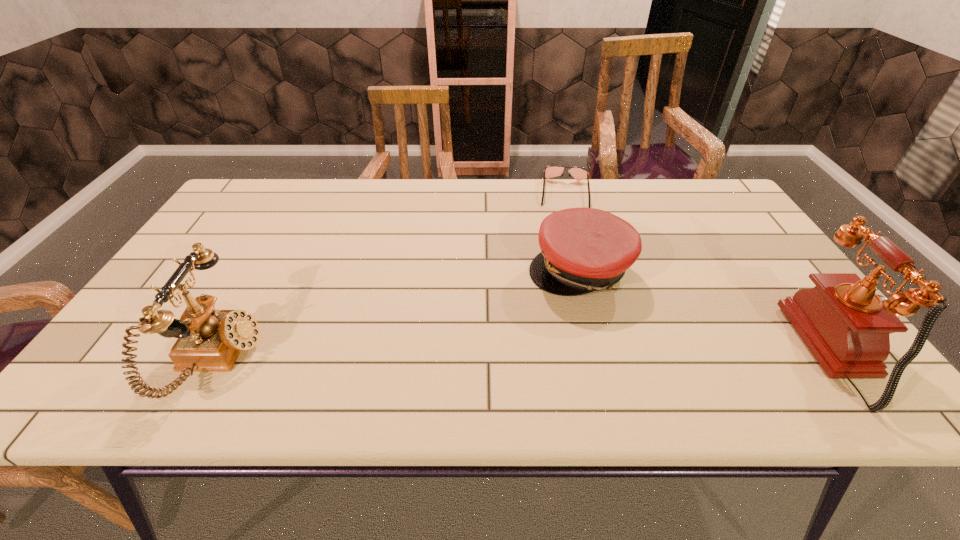
In the image, there is a desktop. What are the coordinates of `vacant space at the near edge` in the screenshot? It's located at (403, 357).

You are a GUI agent. You are given a task and a screenshot of the screen. Output one action in this format:
    pyautogui.click(x=<x>, y=<y>)
    Task: Click on the vacant space at the left edge of the desktop
    This screenshot has height=540, width=960.
    Given the screenshot: What is the action you would take?
    pyautogui.click(x=161, y=287)

Locate an element on the screen. This screenshot has width=960, height=540. vacant space at the right edge is located at coordinates (711, 246).

The width and height of the screenshot is (960, 540). In the image, there is a desktop. Identify the location of vacant space at the far left corner. (288, 184).

The image size is (960, 540). In the image, there is a desktop. Find the location of `free space at the far right corner`. free space at the far right corner is located at coordinates (713, 198).

Locate an element on the screen. This screenshot has height=540, width=960. vacant region at the near right corner is located at coordinates (810, 364).

Locate an element on the screen. empty location between the shortest object and the tallest object is located at coordinates (704, 273).

This screenshot has width=960, height=540. Identify the location of vacant space that is in between the third tallest object and the second tallest object. (399, 315).

Find the location of a particular element. free spot between the tallest object and the left telephone is located at coordinates click(530, 356).

Find the location of `free space between the sunglasses and the second tallest object`. free space between the sunglasses and the second tallest object is located at coordinates (392, 276).